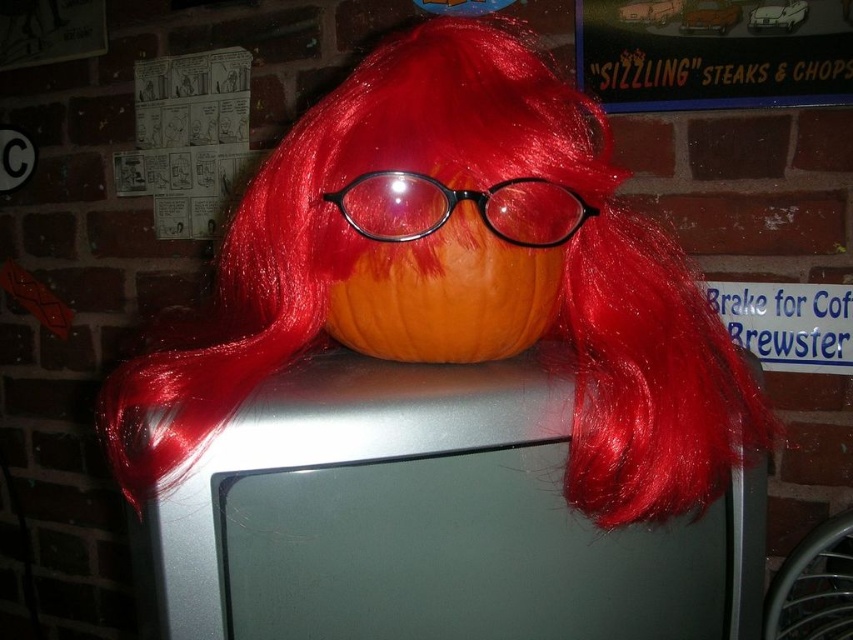
Is matte orange pumpkin at center bigger than orange matte pumpkin at center?

Correct, matte orange pumpkin at center is larger in size than orange matte pumpkin at center.

Between point (576, 156) and point (520, 248), which one is positioned behind?

Positioned behind is point (576, 156).

Find the location of a particular element. The image size is (853, 640). matte orange pumpkin at center is located at coordinates (456, 276).

Who is positioned more to the left, orange matte pumpkin at center or black plastic glasses at center?

From the viewer's perspective, orange matte pumpkin at center appears more on the left side.

Does orange matte pumpkin at center appear on the left side of black plastic glasses at center?

Correct, you'll find orange matte pumpkin at center to the left of black plastic glasses at center.

Who is more forward, (368, 333) or (403, 211)?

Point (403, 211) is in front.

I want to click on orange matte pumpkin at center, so click(x=450, y=266).

Measure the distance between point (572,257) and camera.

Point (572,257) is 52.55 centimeters from camera.

Between point (409, 134) and point (396, 179), which one is positioned in front?

Point (396, 179)

Who is more forward, (627, 304) or (380, 184)?

Point (380, 184) is in front.

You are a GUI agent. You are given a task and a screenshot of the screen. Output one action in this format:
    pyautogui.click(x=<x>, y=<y>)
    Task: Click on the matte orange pumpkin at center
    This screenshot has height=640, width=853.
    Given the screenshot: What is the action you would take?
    pyautogui.click(x=456, y=276)